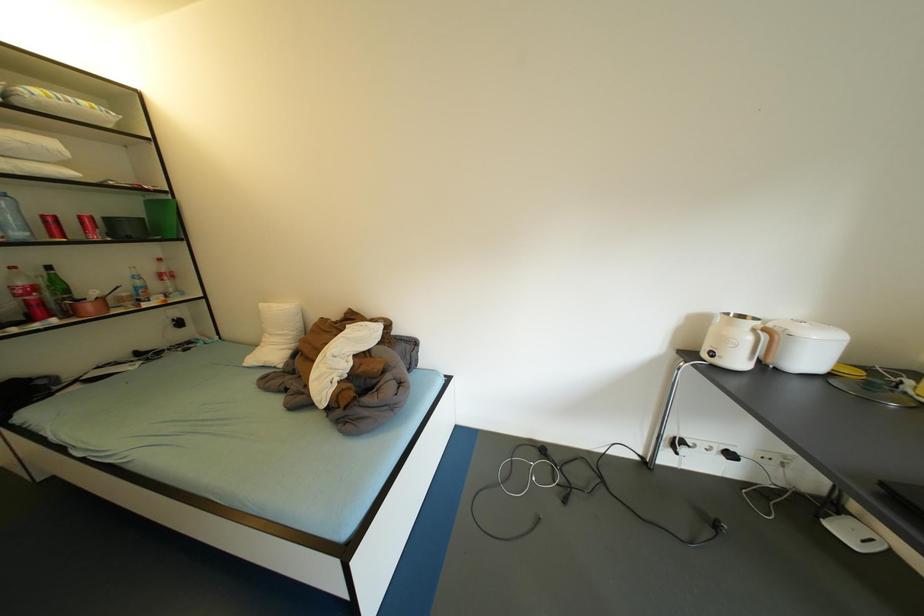
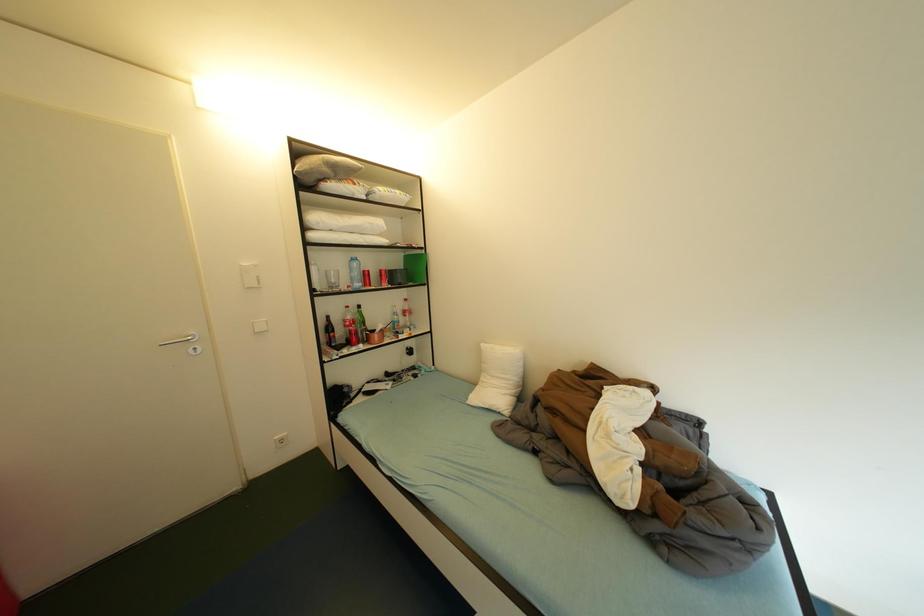
Question: The camera is either moving clockwise (left) or counter-clockwise (right) around the object. The first image is from the beginning of the video and the second image is from the end. Is the camera moving left or right when shooting the video?

Choices:
 (A) Left
 (B) Right

Answer: (B)